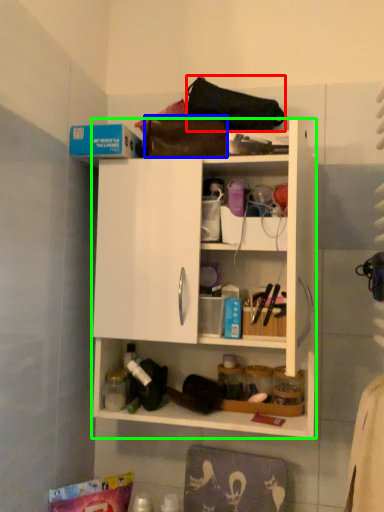
Question: Which object is positioned farthest from handbag (highlighted by a red box)? Select from handbag (highlighted by a blue box) and cabinetry (highlighted by a green box).

Choices:
 (A) handbag
 (B) cabinetry

Answer: (B)